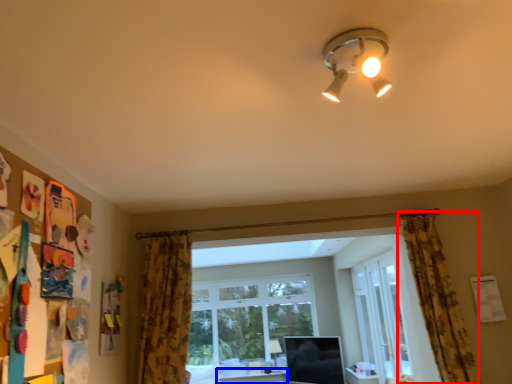
Question: Which object is closer to the camera taking this photo, curtain (highlighted by a red box) or table (highlighted by a blue box)?

Choices:
 (A) curtain
 (B) table

Answer: (A)